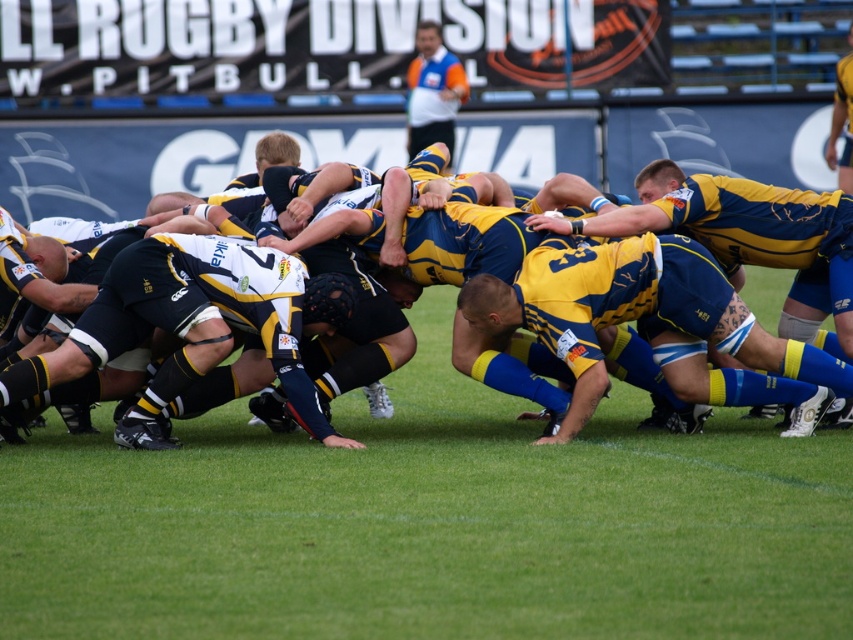
You are a sports analyst watching the rugby scrum. You notice two key players wearing the yellow and blue rugby jersey at center and the blue jersey at center. Which player is positioned to the right of the other?

The yellow and blue rugby jersey at center is positioned on the right side of blue jersey at center.